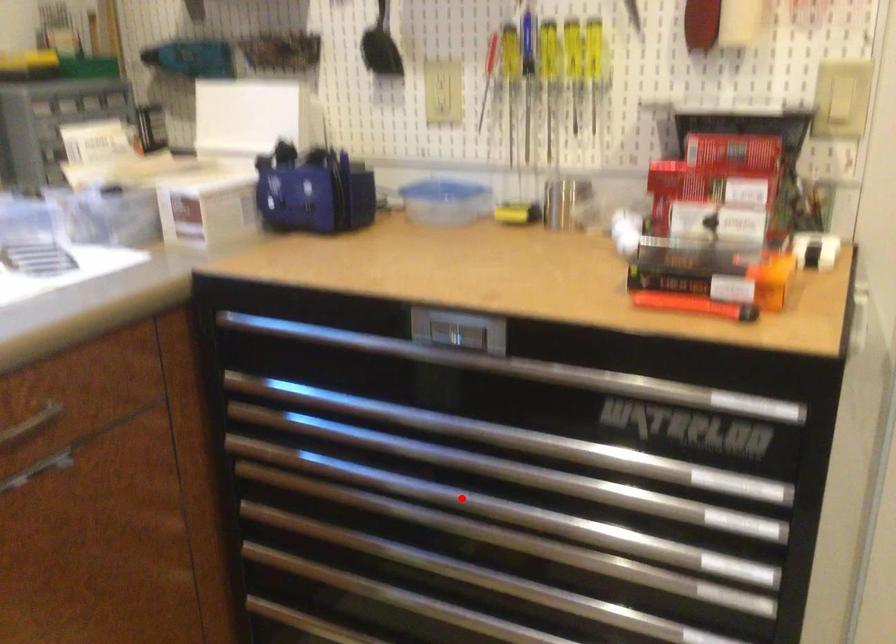
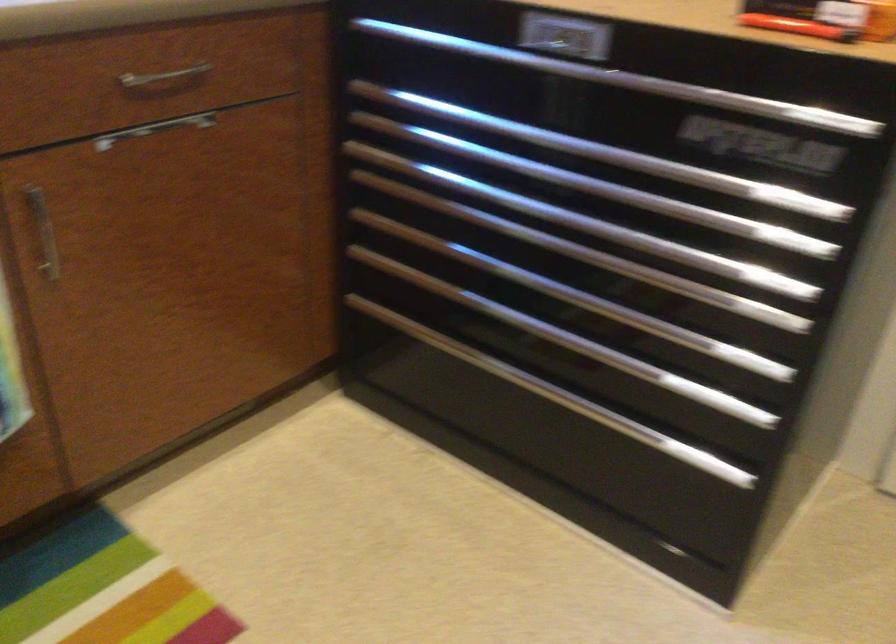
Question: I am providing you with two images of the same scene from different viewpoints. A red point is marked on the first image. Can you still see the location of the red point in image 2?

Choices:
 (A) Yes
 (B) No

Answer: (A)